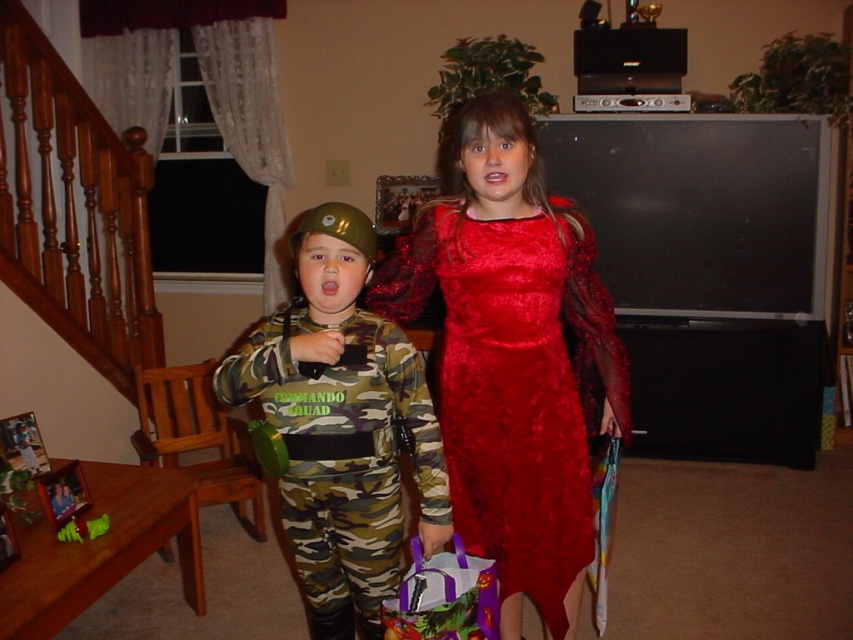
What is located at the coordinates point (514, 356) in the image?

The shiny red dress at center is located at point (514, 356).

You are a photographer taking pictures of the two children in the living room. You notice the shiny red dress at center and the camo fabric uniform at center. Which child should you adjust to ensure both are visible in the photo?

The shiny red dress at center is above the camo fabric uniform at center, so you should adjust the position of the child in the camo fabric uniform at center to ensure both are fully visible in the photo.

You are a photographer at a costume party. You want to take a photo of the shiny red dress at center from a distance that is exactly 5 feet away. Is this possible?

The shiny red dress at center and camera are 5.73 feet apart from each other. Since 5.73 feet is greater than 5 feet, you can position the camera 5 feet away from the shiny red dress at center to take the photo.